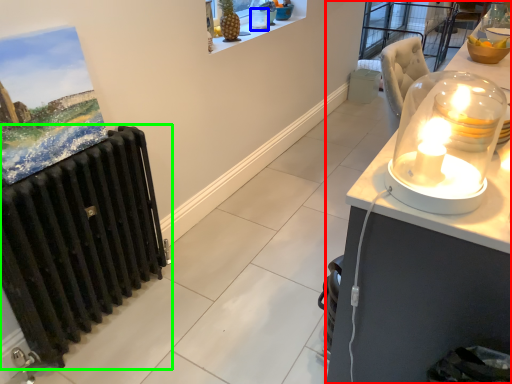
Question: Estimate the real-world distances between objects in this image. Which object is farther from desk (highlighted by a red box), candle holder (highlighted by a blue box) or radiator (highlighted by a green box)?

Choices:
 (A) candle holder
 (B) radiator

Answer: (A)